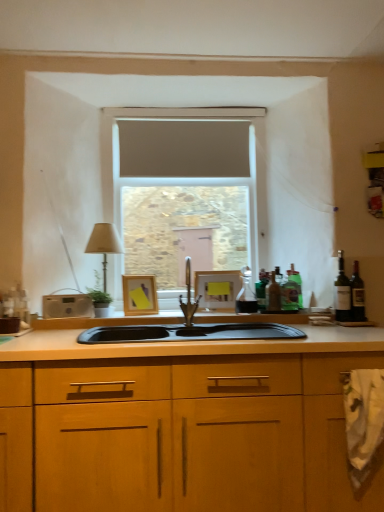
Image resolution: width=384 pixels, height=512 pixels. Find the location of `free spot above matte gray screen at center (from a real-world perspective)`. free spot above matte gray screen at center (from a real-world perspective) is located at coordinates (188, 110).